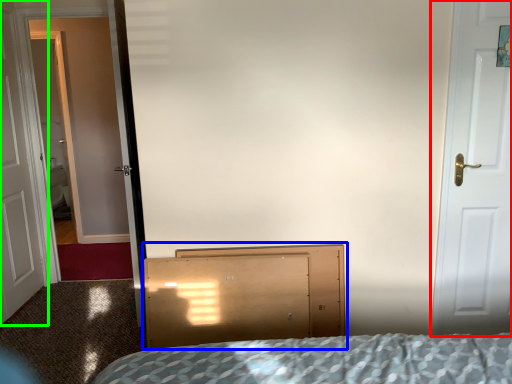
Question: Considering the real-world distances, which object is closest to door (highlighted by a red box)? dresser (highlighted by a blue box) or door (highlighted by a green box).

Choices:
 (A) dresser
 (B) door

Answer: (A)